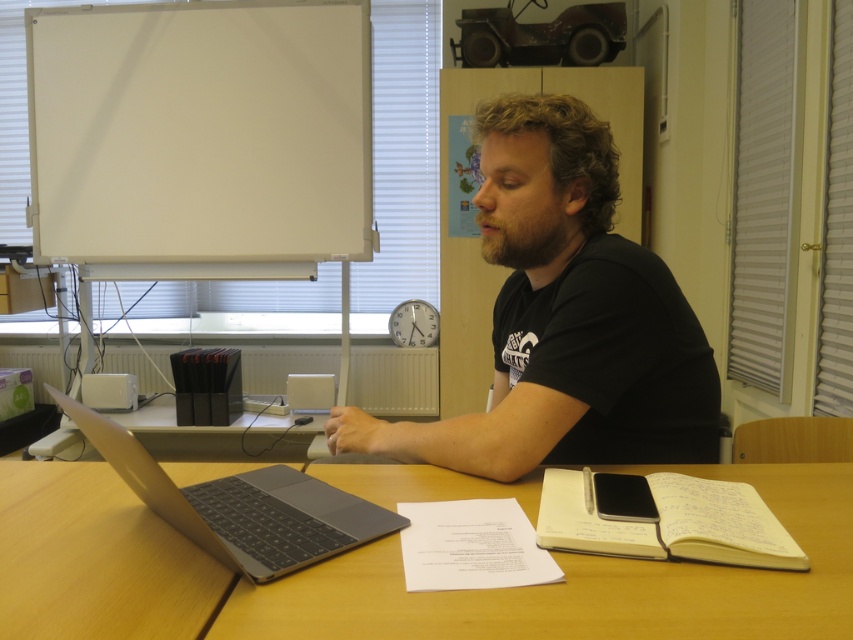
Is wooden table at center thinner than silver metallic laptop at center?

Incorrect, wooden table at center's width is not less than silver metallic laptop at center's.

What do you see at coordinates (395, 576) in the screenshot?
I see `wooden table at center` at bounding box center [395, 576].

Who is more distant from viewer, (15,614) or (123,474)?

The point (123,474) is behind.

The width and height of the screenshot is (853, 640). Identify the location of wooden table at center. (395, 576).

Does wooden table at center appear under white matte board at upper left?

Yes.

Is wooden table at center closer to the viewer compared to white matte board at upper left?

Yes, wooden table at center is closer to the viewer.

What do you see at coordinates (395, 576) in the screenshot? The width and height of the screenshot is (853, 640). I see `wooden table at center` at bounding box center [395, 576].

In order to click on wooden table at center in this screenshot , I will do `click(395, 576)`.

Does white matte board at upper left appear under silver metallic laptop at center?

Actually, white matte board at upper left is above silver metallic laptop at center.

Does white matte board at upper left have a greater width compared to silver metallic laptop at center?

Indeed, white matte board at upper left has a greater width compared to silver metallic laptop at center.

This screenshot has height=640, width=853. I want to click on white matte board at upper left, so click(403, 156).